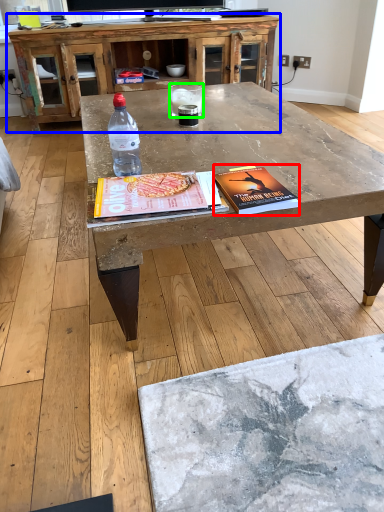
Question: Which is farther away from paperback book (highlighted by a red box)? cabinetry (highlighted by a blue box) or water (highlighted by a green box)?

Choices:
 (A) cabinetry
 (B) water

Answer: (A)